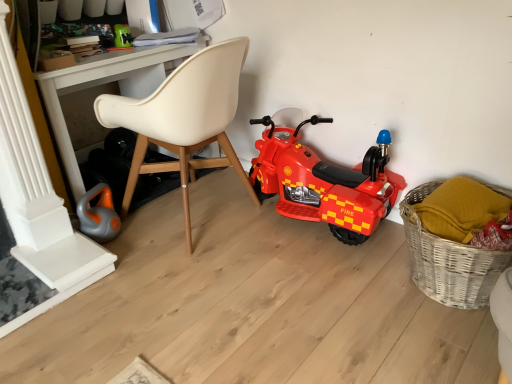
Identify the location of free location in front of red plastic toy motorcycle at center. Image resolution: width=512 pixels, height=384 pixels. (308, 278).